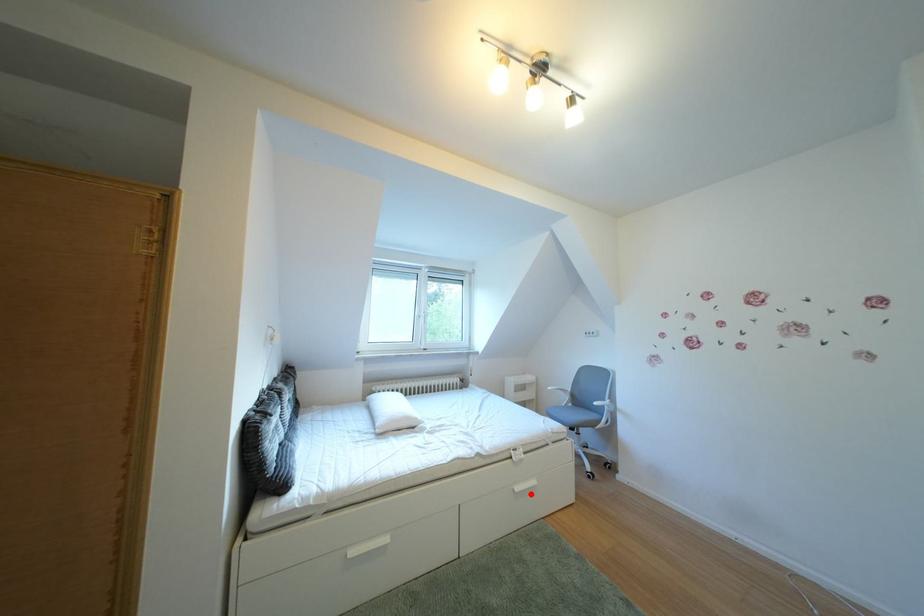
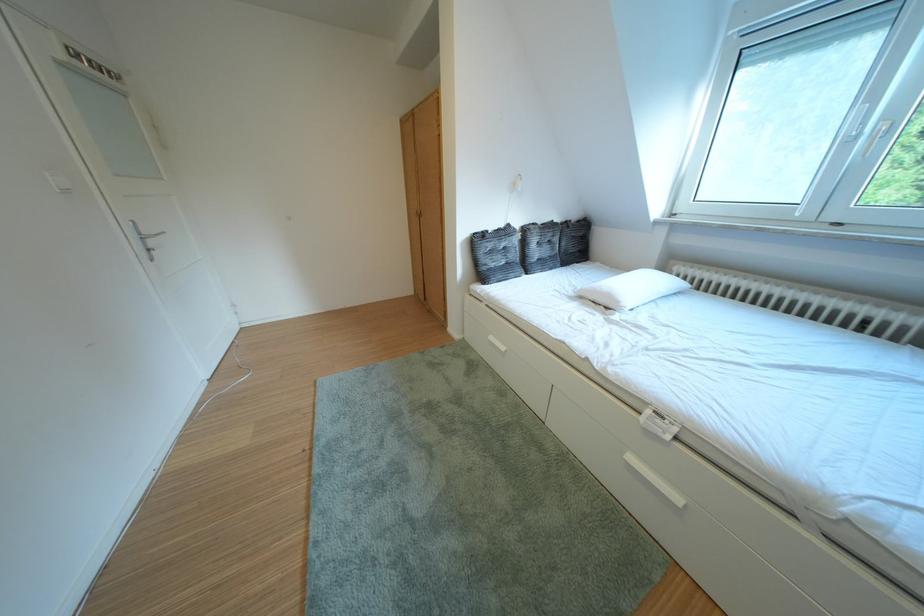
Question: I am providing you with two images of the same scene from different viewpoints. In image1, a red point is highlighted. Considering the same 3D point in image2, which of the following is correct?

Choices:
 (A) It is closer
 (B) It is farther

Answer: (A)